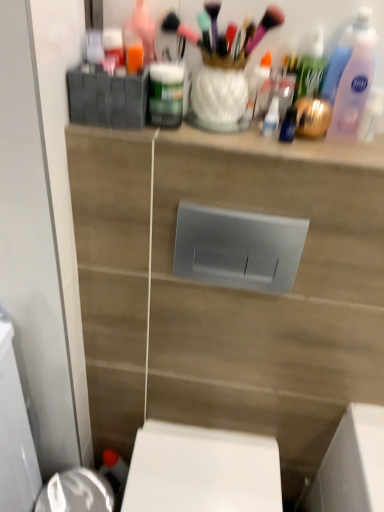
Where is `vacant area on top of matte plastic toiletries at upper center (from a real-world perspective)`? This screenshot has width=384, height=512. vacant area on top of matte plastic toiletries at upper center (from a real-world perspective) is located at coordinates (250, 126).